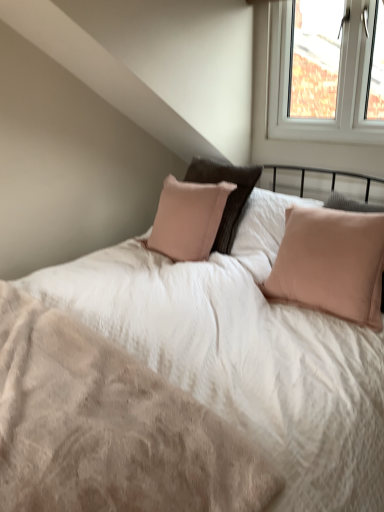
Question: Does beige soft fabric mattress at center lie in front of white plastic window at upper right?

Choices:
 (A) yes
 (B) no

Answer: (A)

Question: From a real-world perspective, is beige soft fabric mattress at center over white plastic window at upper right?

Choices:
 (A) yes
 (B) no

Answer: (B)

Question: Is there a large distance between beige soft fabric mattress at center and white plastic window at upper right?

Choices:
 (A) yes
 (B) no

Answer: (A)

Question: Is beige soft fabric mattress at center bigger than white plastic window at upper right?

Choices:
 (A) no
 (B) yes

Answer: (B)

Question: Is beige soft fabric mattress at center smaller than white plastic window at upper right?

Choices:
 (A) no
 (B) yes

Answer: (A)

Question: Would you say pale pink fabric pillow at right is inside or outside beige soft fabric mattress at center?

Choices:
 (A) inside
 (B) outside

Answer: (B)

Question: Is pale pink fabric pillow at right bigger or smaller than beige soft fabric mattress at center?

Choices:
 (A) small
 (B) big

Answer: (B)

Question: From a real-world perspective, is pale pink fabric pillow at right physically located above or below beige soft fabric mattress at center?

Choices:
 (A) above
 (B) below

Answer: (A)

Question: Considering their positions, is pale pink fabric pillow at right located in front of or behind beige soft fabric mattress at center?

Choices:
 (A) behind
 (B) front

Answer: (A)

Question: Visually, is white plastic window at upper right positioned to the left or to the right of pale pink fabric pillow at right?

Choices:
 (A) right
 (B) left

Answer: (A)

Question: Does point (269, 119) appear closer or farther from the camera than point (354, 263)?

Choices:
 (A) closer
 (B) farther

Answer: (B)

Question: Is white plastic window at upper right in front of or behind pale pink fabric pillow at right in the image?

Choices:
 (A) front
 (B) behind

Answer: (B)

Question: In terms of height, does white plastic window at upper right look taller or shorter compared to pale pink fabric pillow at right?

Choices:
 (A) short
 (B) tall

Answer: (B)

Question: Which is correct: beige soft fabric mattress at center is inside pale pink fabric pillow at right, or outside of it?

Choices:
 (A) outside
 (B) inside

Answer: (A)

Question: From the image's perspective, is beige soft fabric mattress at center located above or below pale pink fabric pillow at right?

Choices:
 (A) below
 (B) above

Answer: (A)